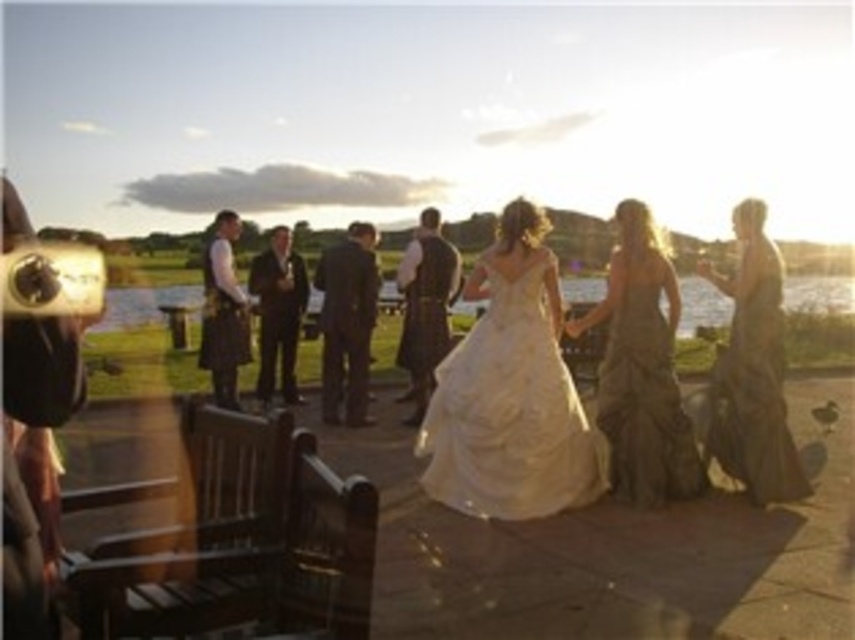
Question: Which point appears closest to the camera in this image?

Choices:
 (A) (545, 506)
 (B) (752, 209)
 (C) (363, 406)

Answer: (A)

Question: Estimate the real-world distances between objects in this image. Which object is farther from the dark suit at center?

Choices:
 (A) dark gray suit at center
 (B) velvet brown vest at center

Answer: (B)

Question: Estimate the real-world distances between objects in this image. Which object is closer to the velvet brown vest at center?

Choices:
 (A) matte olive green dress at right
 (B) shiny silver dress at center
 (C) ivory satin gown at center

Answer: (C)

Question: Is dark gray suit at center to the right of velvet brown vest at center from the viewer's perspective?

Choices:
 (A) yes
 (B) no

Answer: (B)

Question: Where is dark gray suit at center located in relation to dark gray kilt at center in the image?

Choices:
 (A) below
 (B) above

Answer: (A)

Question: Considering the relative positions of matte olive green dress at right and dark gray kilt at center in the image provided, where is matte olive green dress at right located with respect to dark gray kilt at center?

Choices:
 (A) above
 (B) below

Answer: (B)